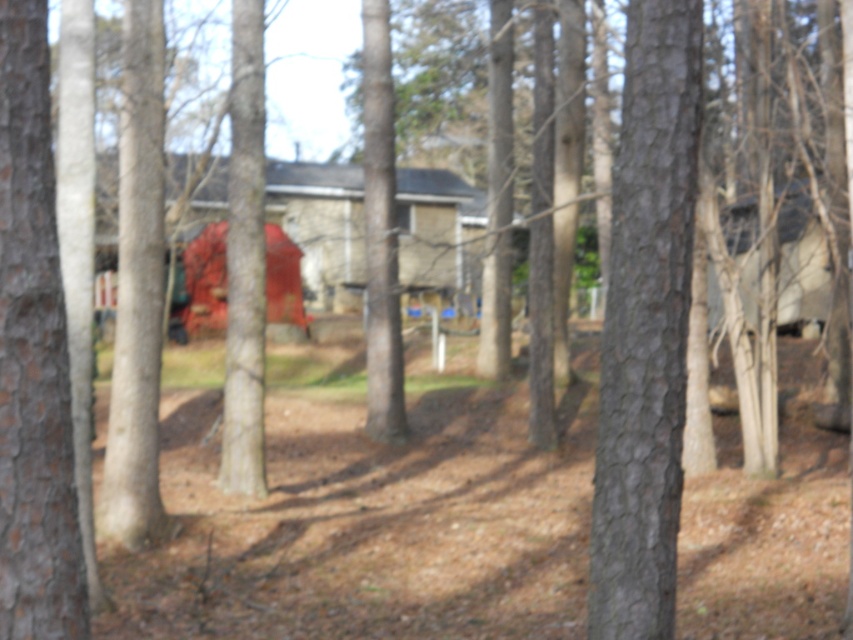
Is smooth bark tree at center below smooth bark tree at left?

No.

Does smooth bark tree at center have a lesser height compared to smooth bark tree at left?

Incorrect, smooth bark tree at center's height does not fall short of smooth bark tree at left's.

This screenshot has width=853, height=640. What do you see at coordinates (646, 326) in the screenshot? I see `smooth bark tree at center` at bounding box center [646, 326].

I want to click on smooth bark tree at center, so click(646, 326).